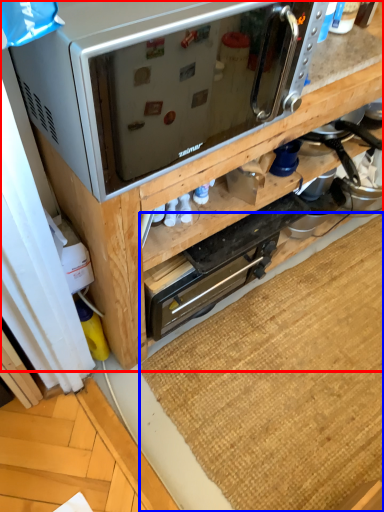
Question: Which point is closer to the camera, cabinetry (highlighted by a red box) or doormat (highlighted by a blue box)?

Choices:
 (A) cabinetry
 (B) doormat

Answer: (A)